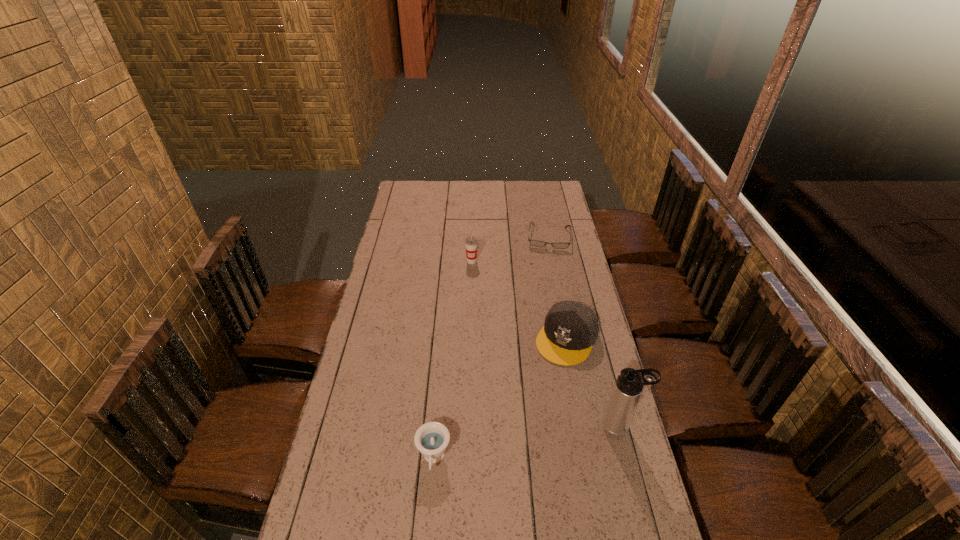
Identify the location of vacant space located on the front-facing side of the cap. This screenshot has width=960, height=540. (518, 427).

Where is `free location located 0.390m on the front-facing side of the cap`? This screenshot has height=540, width=960. free location located 0.390m on the front-facing side of the cap is located at coordinates (503, 454).

I want to click on free space located on the front-facing side of the spectacles, so click(x=544, y=302).

Where is `free spot located on the front-facing side of the spectacles`? The height and width of the screenshot is (540, 960). free spot located on the front-facing side of the spectacles is located at coordinates (547, 263).

Locate an element on the screen. The image size is (960, 540). vacant space situated on the front-facing side of the spectacles is located at coordinates (544, 300).

Locate an element on the screen. vacant space located on the side of the second object from left to right with the logo is located at coordinates (483, 321).

You are a GUI agent. You are given a task and a screenshot of the screen. Output one action in this format:
    pyautogui.click(x=<x>, y=<y>)
    Task: Click on the vacant space situated 0.150m on the side of the second object from left to right with the logo
    This screenshot has height=540, width=960.
    Given the screenshot: What is the action you would take?
    point(477,288)

At what (x,y) coordinates should I click in order to perform the action: click on vacant space located on the side of the second object from left to right with the logo. Please return your answer as a coordinate pair (x, y). The height and width of the screenshot is (540, 960). Looking at the image, I should click on (484, 326).

Where is `thermos bottle located at the right edge`? The width and height of the screenshot is (960, 540). thermos bottle located at the right edge is located at coordinates (629, 385).

Locate an element on the screen. The width and height of the screenshot is (960, 540). cap at the right edge is located at coordinates (571, 328).